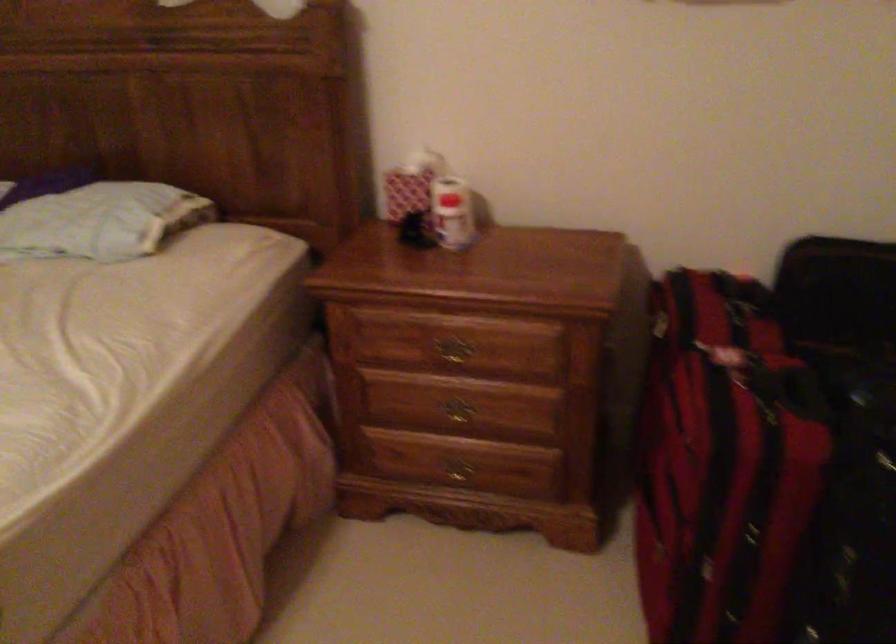
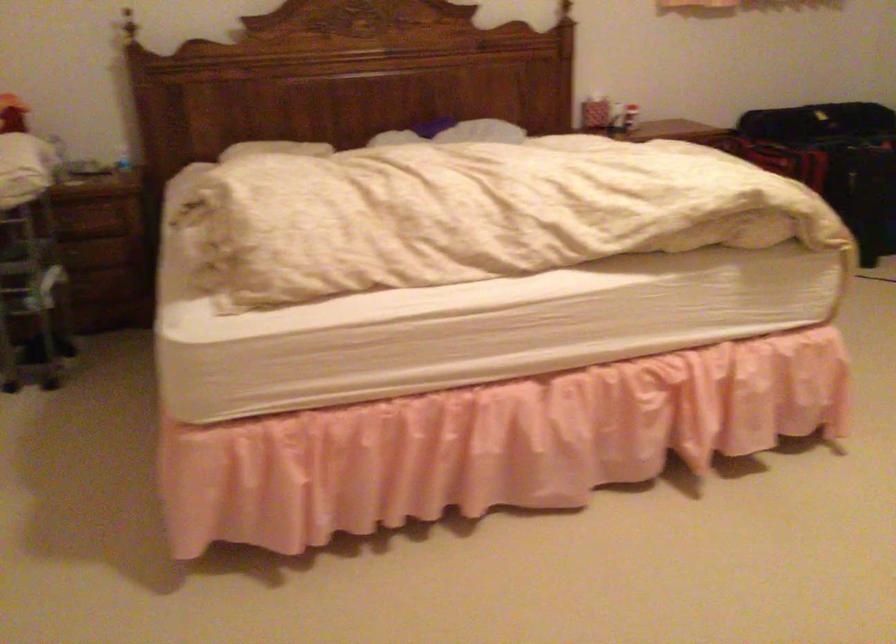
Question: I am providing you with two images of the same scene from different viewpoints. Please identify which objects are invisible in image2.

Choices:
 (A) plastic water bottle
 (B) red and white box
 (C) brass drawer handle
 (D) gray sitting surface

Answer: (C)